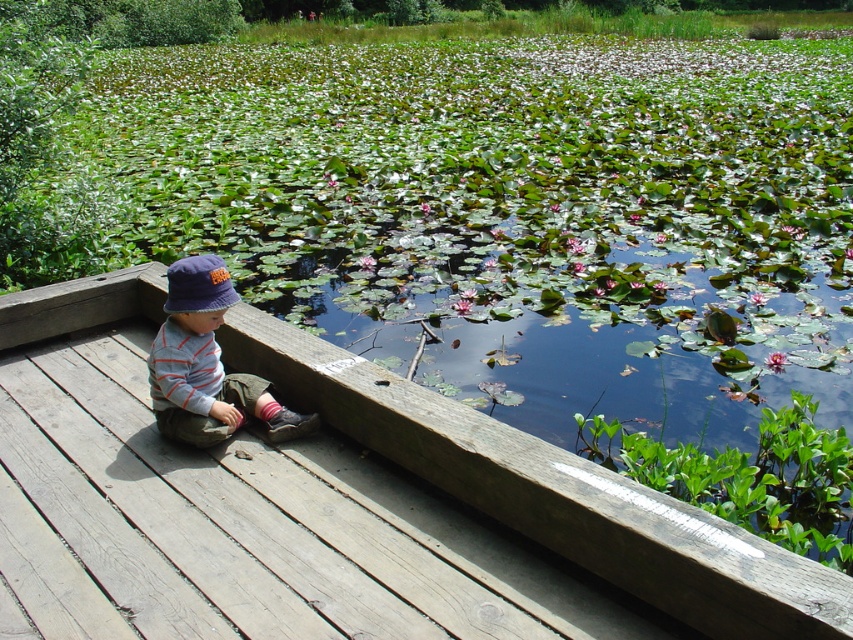
Question: Which of the following is the closest to the observer?

Choices:
 (A) blue fabric hat at left
 (B) wooden deck at center

Answer: (B)

Question: Is wooden deck at center to the left of blue fabric hat at left from the viewer's perspective?

Choices:
 (A) no
 (B) yes

Answer: (A)

Question: Which point is farther to the camera?

Choices:
 (A) wooden deck at center
 (B) blue fabric hat at left
 (C) striped cotton shirt at left

Answer: (C)

Question: Which point is closer to the camera taking this photo?

Choices:
 (A) (213, 292)
 (B) (184, 433)
 (C) (146, 307)

Answer: (A)

Question: Is wooden deck at center further to the viewer compared to blue fabric hat at left?

Choices:
 (A) yes
 (B) no

Answer: (B)

Question: Is wooden deck at center smaller than striped cotton shirt at left?

Choices:
 (A) yes
 (B) no

Answer: (B)